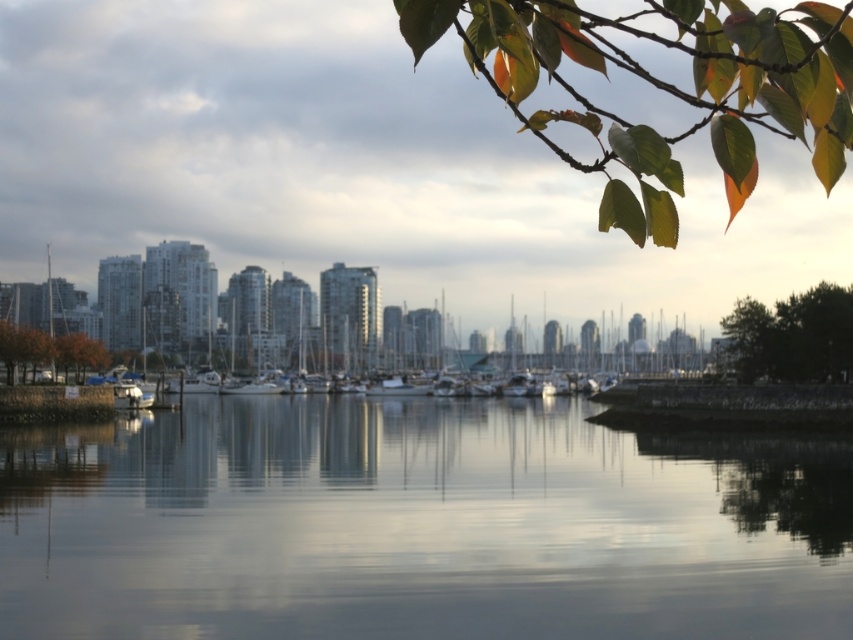
Looking at this image, you are an environmental scientist assessing water quality. You observe the clear water at center and the orange matte tree at left in the waterfront scene. Based on their positions, which object is more likely to be affected by pollutants from the city buildings in the midground?

The clear water at center is more likely to be affected by pollutants from the city buildings in the midground because it is positioned closer to the urban area compared to the orange matte tree at left.

You are an artist trying to paint the waterfront scene. You notice the clear water at center and the green leafy branch at upper right. Which object is located to the left of the other?

The clear water at center is positioned on the left side of green leafy branch at upper right.